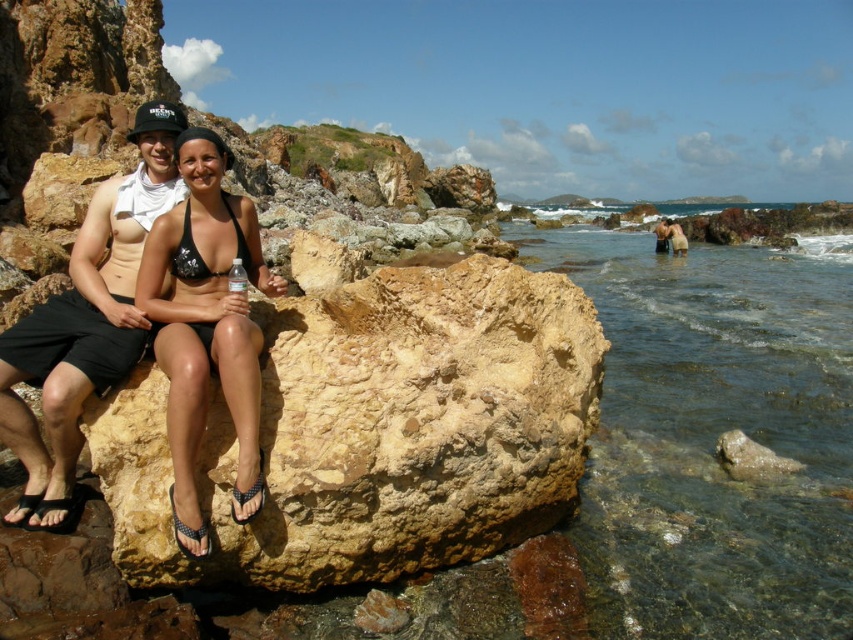
Question: Can you confirm if black matte bikini top at center is wider than matte black bikini at lower right?

Choices:
 (A) no
 (B) yes

Answer: (A)

Question: Does black bikini at center appear on the right side of matte black bikini at lower right?

Choices:
 (A) yes
 (B) no

Answer: (B)

Question: Which point appears closest to the camera in this image?

Choices:
 (A) (44, 400)
 (B) (247, 250)
 (C) (167, 300)
 (D) (726, 392)

Answer: (A)

Question: Which is farther from the black matte bikini top at center?

Choices:
 (A) clear water at lower right
 (B) black bikini at center
 (C) matte black shorts at left

Answer: (A)

Question: Which object is farther from the camera taking this photo?

Choices:
 (A) black matte bikini top at center
 (B) matte black bikini at lower right
 (C) matte black shorts at left
 (D) clear water at lower right

Answer: (B)

Question: Does matte black shorts at left appear over matte black bikini at lower right?

Choices:
 (A) yes
 (B) no

Answer: (B)